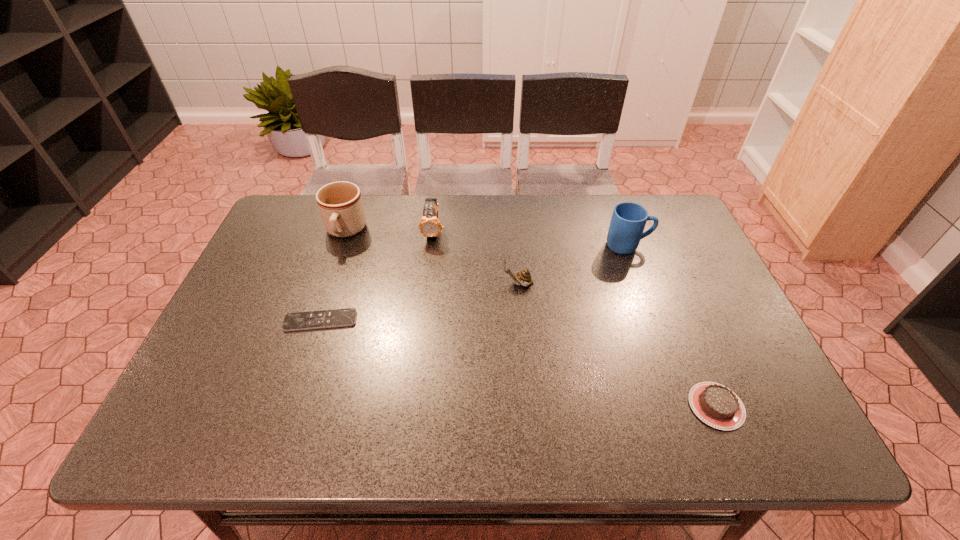
Locate an element on the screen. The height and width of the screenshot is (540, 960). vacant region located 0.050m on the side of the right mug with the handle is located at coordinates (667, 246).

The height and width of the screenshot is (540, 960). Identify the location of vacant region located on the face of the fourth object from right to left. (425, 307).

You are a GUI agent. You are given a task and a screenshot of the screen. Output one action in this format:
    pyautogui.click(x=<x>, y=<y>)
    Task: Click on the free region located on the face of the fourth object from left to right
    
    Given the screenshot: What is the action you would take?
    pyautogui.click(x=393, y=284)

At what (x,y) coordinates should I click in order to perform the action: click on free spot located on the face of the fourth object from left to right. Please return your answer as a coordinate pair (x, y). Image resolution: width=960 pixels, height=540 pixels. Looking at the image, I should click on (399, 284).

Find the location of a particular element. The image size is (960, 540). vacant area situated 0.190m on the face of the fourth object from left to right is located at coordinates (432, 284).

This screenshot has width=960, height=540. What are the coordinates of `free space located 0.290m on the back of the second shortest object` in the screenshot? It's located at (667, 289).

In order to click on vacant region located on the right of the remote control in this screenshot , I will do `click(447, 321)`.

This screenshot has height=540, width=960. Find the location of `watch that is at the far edge`. watch that is at the far edge is located at coordinates (429, 226).

Locate an element on the screen. This screenshot has height=540, width=960. object positioned at the near edge is located at coordinates (716, 405).

Locate an element on the screen. The height and width of the screenshot is (540, 960). object positioned at the left edge is located at coordinates (333, 318).